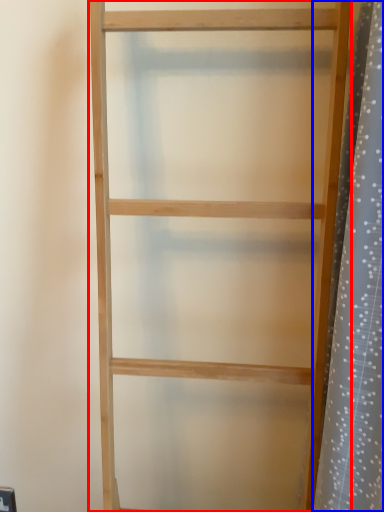
Question: Which of the following is the farthest to the observer, shelf (highlighted by a red box) or shower curtain (highlighted by a blue box)?

Choices:
 (A) shelf
 (B) shower curtain

Answer: (B)